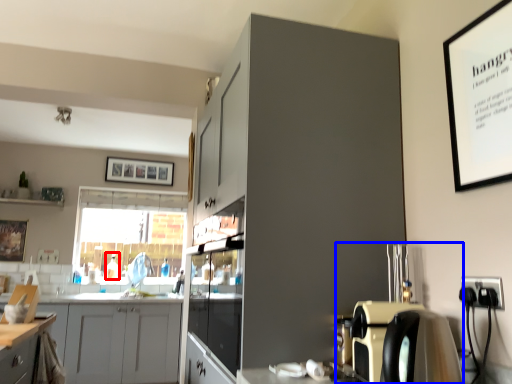
Question: Which object is closer to the camera taking this photo, bottle (highlighted by a red box) or coffee machine (highlighted by a blue box)?

Choices:
 (A) bottle
 (B) coffee machine

Answer: (B)